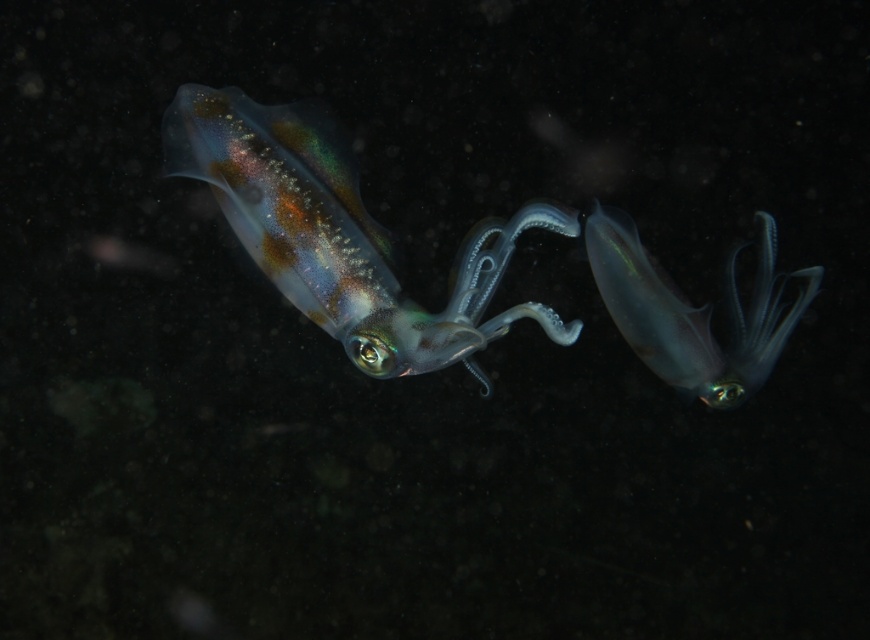
Can you confirm if translucent iridescent squid at center is positioned below translucent blue squid at center?

No.

Can you confirm if translucent iridescent squid at center is wider than translucent blue squid at center?

Indeed, translucent iridescent squid at center has a greater width compared to translucent blue squid at center.

Does point (572, 333) lie in front of point (708, 308)?

Yes, point (572, 333) is closer to viewer.

You are a GUI agent. You are given a task and a screenshot of the screen. Output one action in this format:
    pyautogui.click(x=<x>, y=<y>)
    Task: Click on the translucent iridescent squid at center
    This screenshot has height=640, width=870.
    Given the screenshot: What is the action you would take?
    [343, 234]